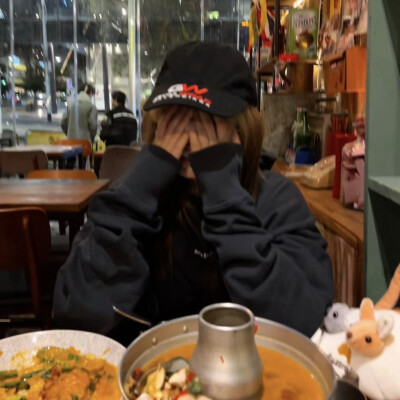
At what (x,y) coordinates should I click in order to perform the action: click on wooden table. Please return your answer as a coordinate pair (x, y). This screenshot has height=400, width=400. Looking at the image, I should click on (58, 196).